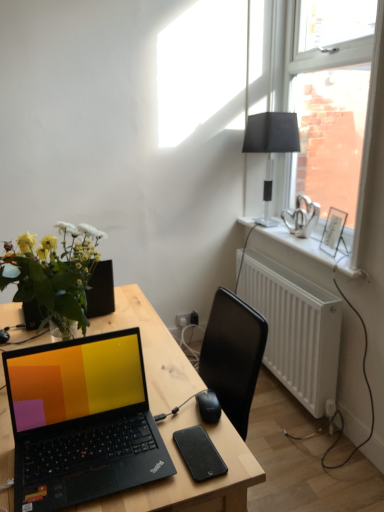
The width and height of the screenshot is (384, 512). I want to click on free space that is in between black plastic mouse at center and black matte tablet at center, so click(x=208, y=428).